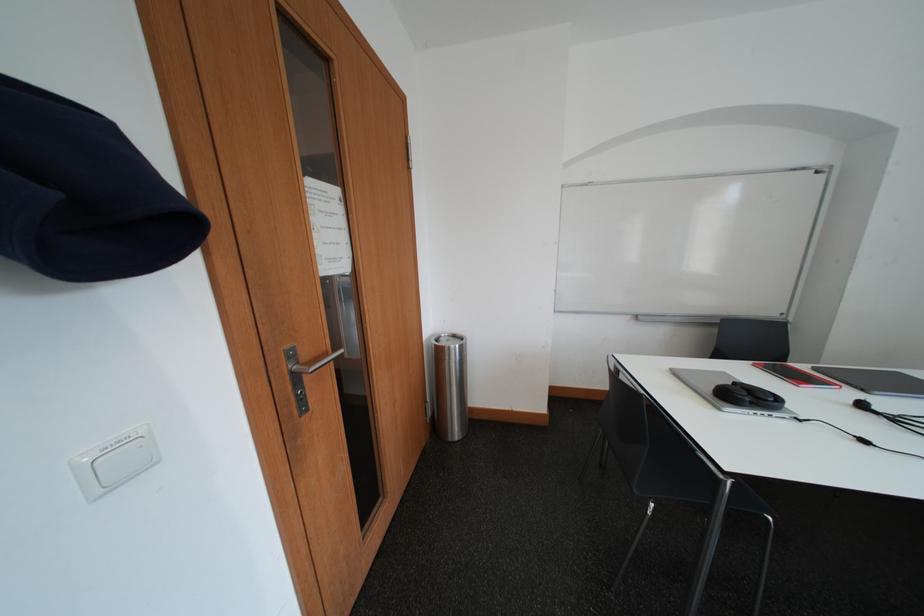
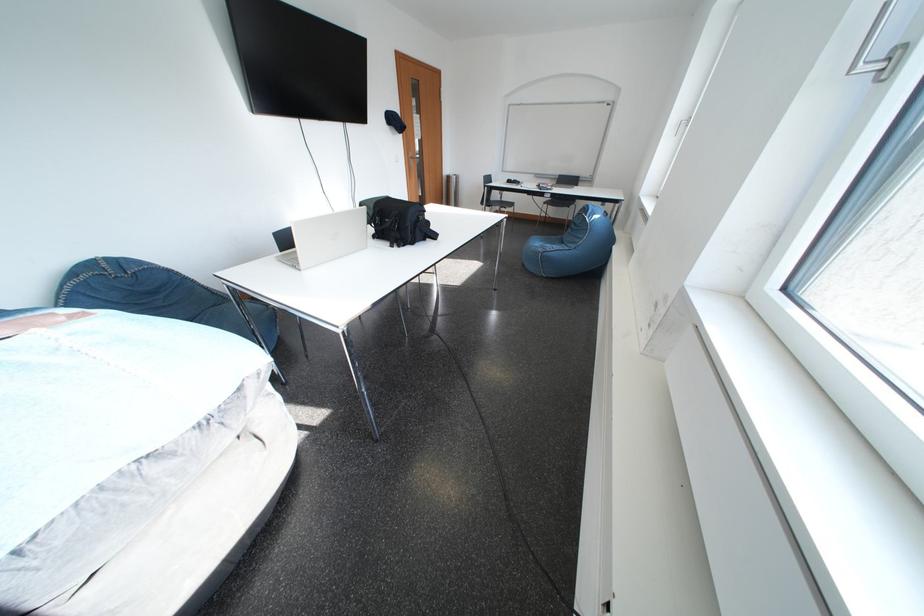
What movement of the cameraman would produce the second image?

The cameraman walked toward right, backward.